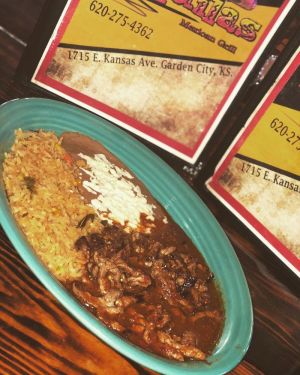
This screenshot has width=300, height=375. I want to click on table, so click(34, 340).